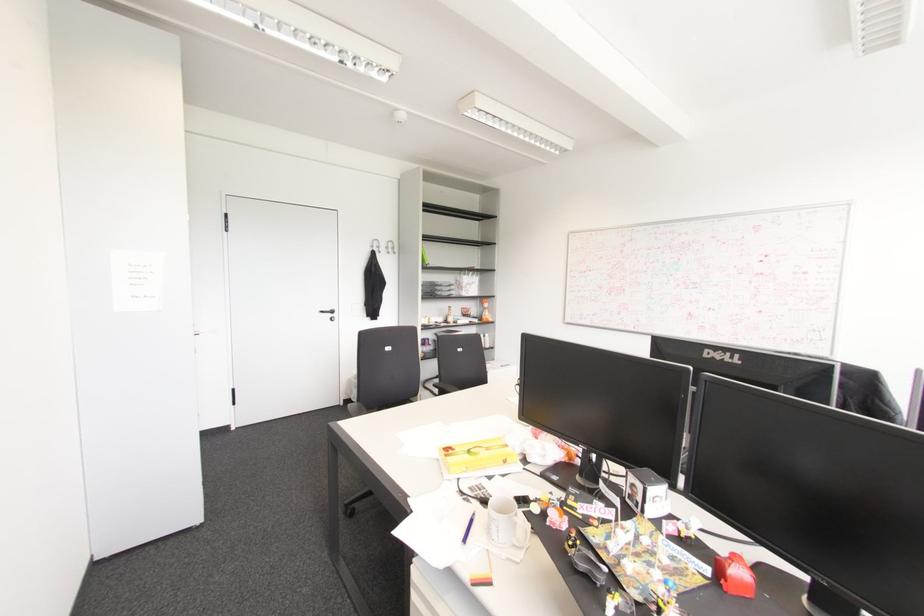
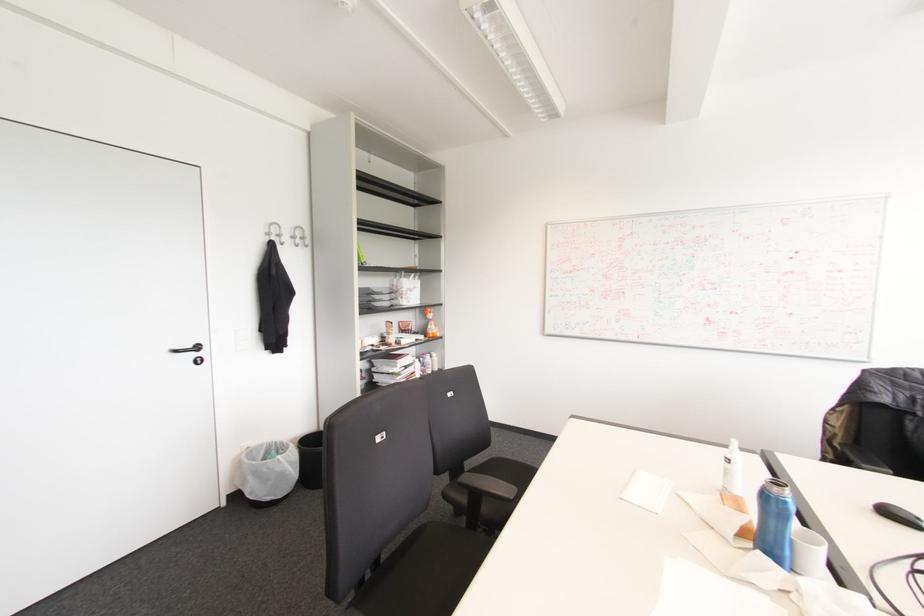
Where in the second image is the point corresponding to point (371, 246) from the first image?

(266, 233)